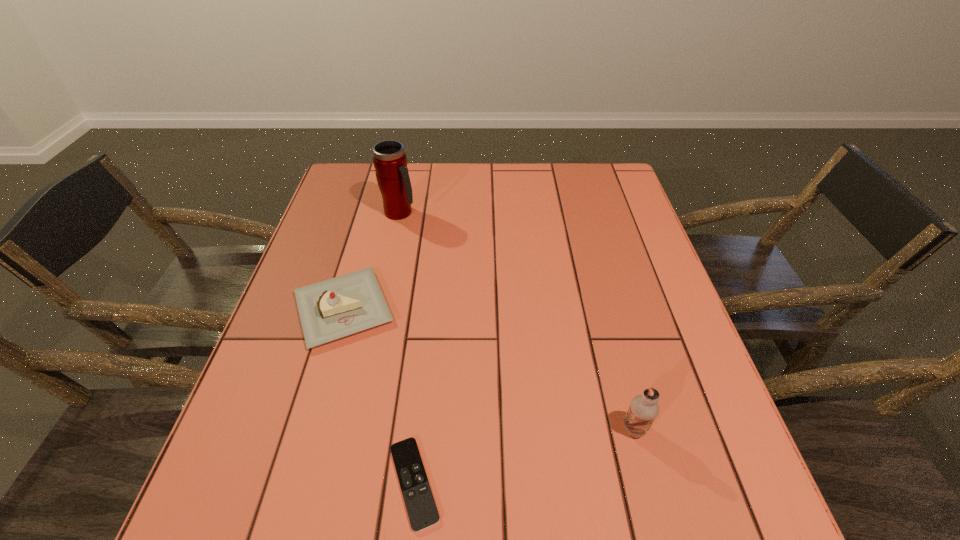
Locate an element on the screen. The width and height of the screenshot is (960, 540). free spot between the second object from right to left and the chocolate milk is located at coordinates point(524,456).

Find the location of a particular element. Image resolution: width=960 pixels, height=540 pixels. blank region between the thermos bottle and the second farthest object is located at coordinates (372, 260).

Identify which object is the nearest to the second shortest object. Please provide its 2D coordinates. Your answer should be formatted as a tuple, i.e. [(x, y)], where the tuple contains the x and y coordinates of a point satisfying the conditions above.

[(422, 511)]

Choose which object is the third nearest neighbor to the cake. Please provide its 2D coordinates. Your answer should be formatted as a tuple, i.e. [(x, y)], where the tuple contains the x and y coordinates of a point satisfying the conditions above.

[(643, 409)]

The width and height of the screenshot is (960, 540). Find the location of `free spot that satisfies the following two spatial constraints: 1. on the side with the handle of the shortest object; 2. on the right side of the tallest object`. free spot that satisfies the following two spatial constraints: 1. on the side with the handle of the shortest object; 2. on the right side of the tallest object is located at coordinates (343, 483).

The height and width of the screenshot is (540, 960). I want to click on free space that satisfies the following two spatial constraints: 1. on the back side of the remote control; 2. on the side with the handle of the thermos bottle, so click(442, 213).

Identify the location of vacant space that satisfies the following two spatial constraints: 1. on the side with the handle of the thermos bottle; 2. on the back side of the shortest object. (343, 483).

Find the location of a particular element. Image resolution: width=960 pixels, height=540 pixels. vacant space that satisfies the following two spatial constraints: 1. on the side with the handle of the chocolate milk; 2. on the left side of the farthest object is located at coordinates (354, 429).

Locate an element on the screen. This screenshot has height=540, width=960. vacant space that satisfies the following two spatial constraints: 1. on the side with the handle of the tallest object; 2. on the left side of the third object from left to right is located at coordinates (343, 483).

I want to click on vacant region that satisfies the following two spatial constraints: 1. on the back side of the rightmost object; 2. on the right side of the shortest object, so click(420, 429).